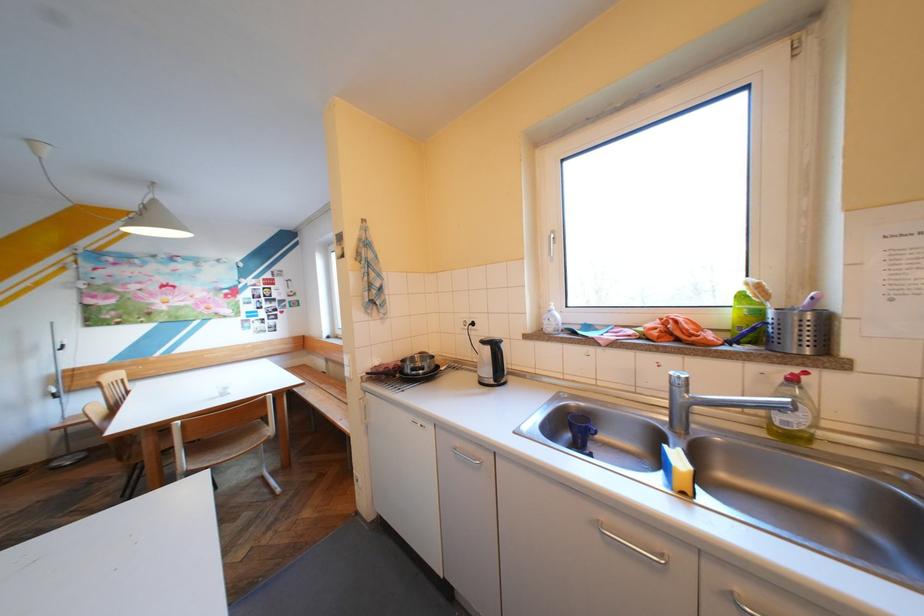
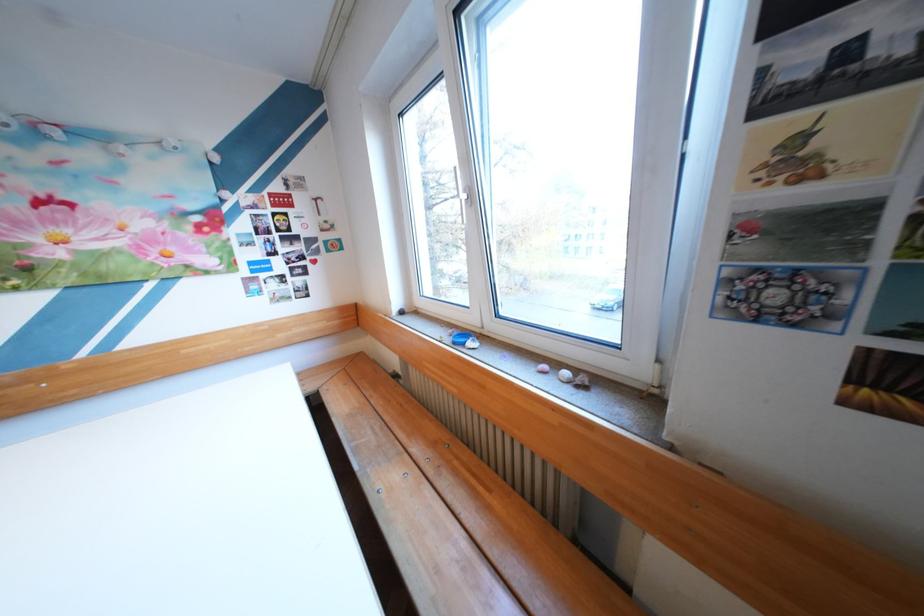
In a continuous first-person perspective shot, in which direction is the camera moving?

The movement direction of the cameraman is left, forward.